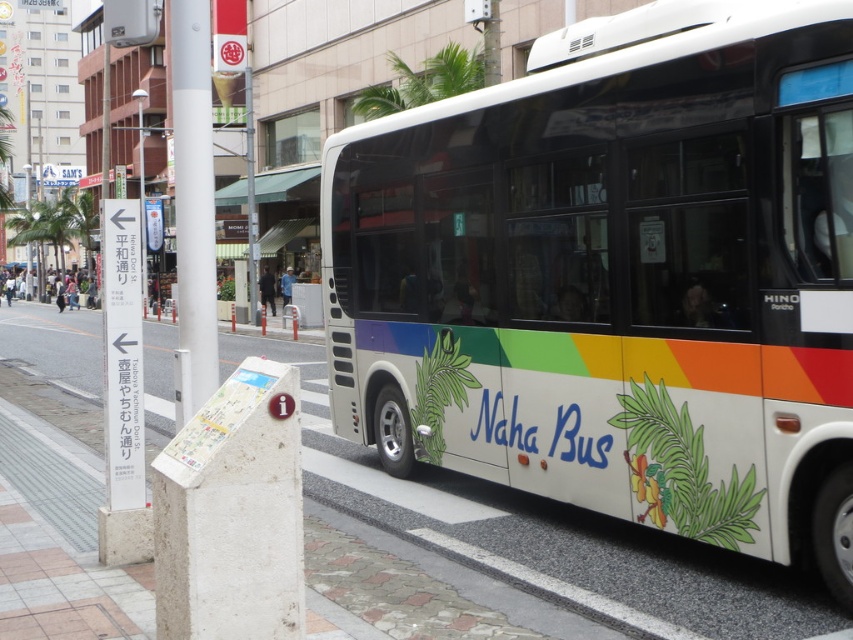
You are standing at the information stand in the scene. Which object is located at the coordinate point (618,276)?

The white glossy bus at right is located at point (618,276).

You are a tourist in Naha and want to find the nearest bus stop. You see the white glossy bus at right and the white concrete pavement at lower center. According to the scene, which object is located above the other?

The white glossy bus at right is positioned under the white concrete pavement at lower center, so the white concrete pavement at lower center is above the white glossy bus at right.